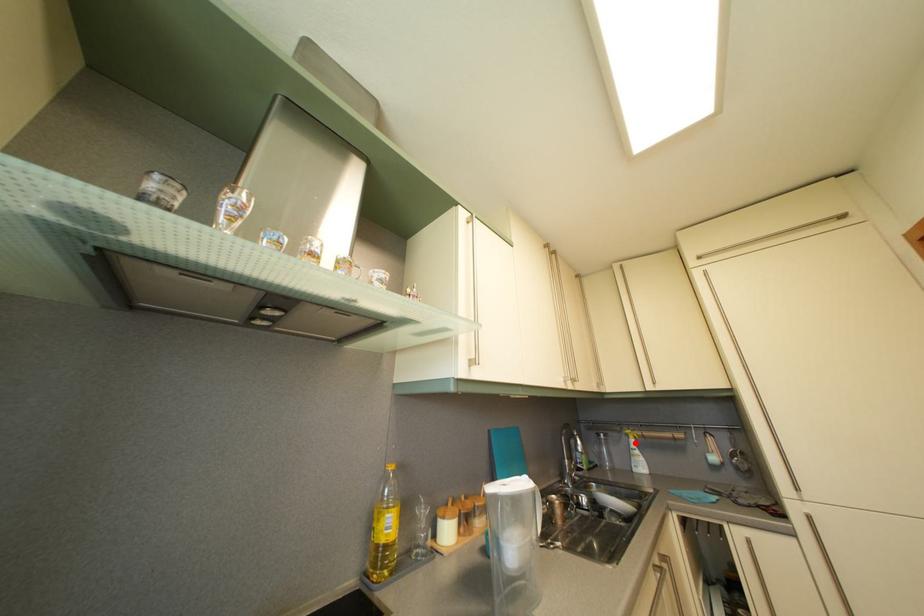
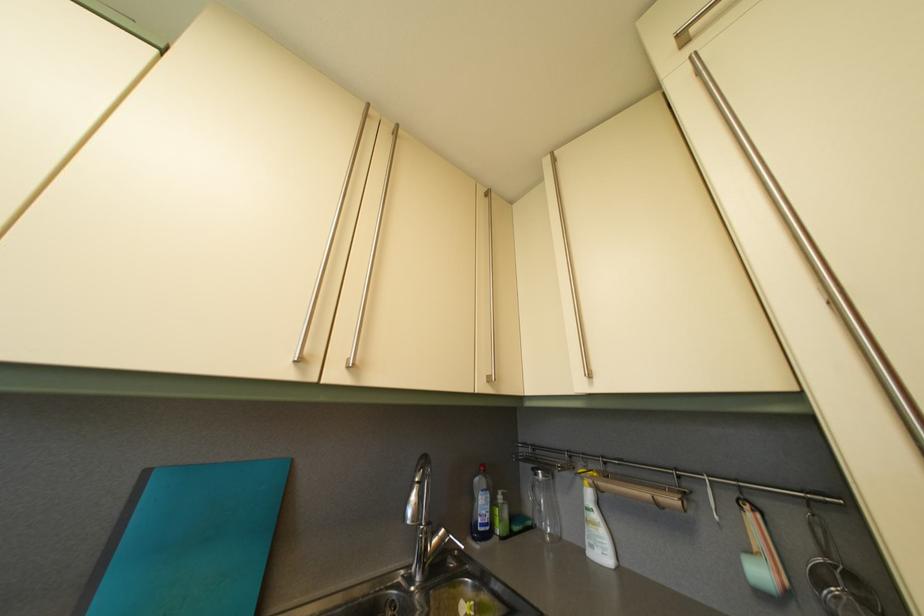
Question: I am providing you with two images of the same scene from different viewpoints. A red point is marked on the first image. Can you still see the location of the red point in image 2?

Choices:
 (A) Yes
 (B) No

Answer: (A)